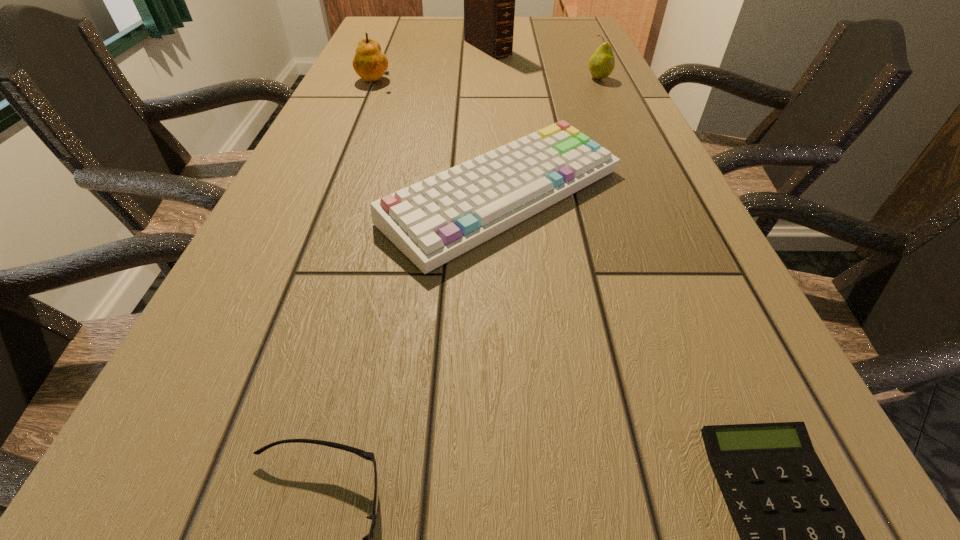
In order to click on free space located 0.060m on the back of the third shortest object in this screenshot , I will do `click(499, 127)`.

Where is `object located at the far edge`? The height and width of the screenshot is (540, 960). object located at the far edge is located at coordinates 489,0.

Locate an element on the screen. object located at the left edge is located at coordinates (370, 63).

Where is `pear positioned at the right edge`? The width and height of the screenshot is (960, 540). pear positioned at the right edge is located at coordinates (602, 62).

Where is `computer keyboard that is at the right edge`? computer keyboard that is at the right edge is located at coordinates (433, 221).

In the image, there is a desktop. Identify the location of free space at the far edge. (538, 21).

The width and height of the screenshot is (960, 540). In the image, there is a desktop. Identify the location of vacant space at the left edge. (293, 172).

This screenshot has height=540, width=960. In order to click on vacant space at the right edge of the desktop in this screenshot , I will do `click(575, 49)`.

Identify the location of vacant space at the far right corner. (566, 33).

In order to click on vacant area that lies between the left pear and the Bible in this screenshot , I will do `click(431, 65)`.